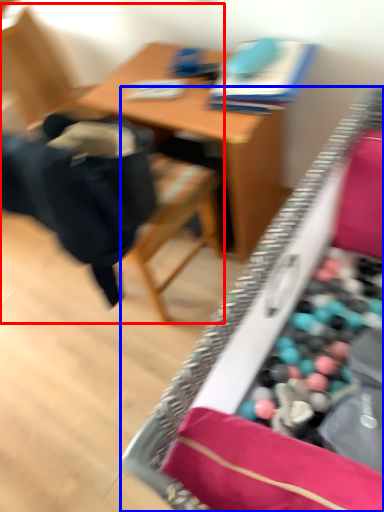
Question: Which object appears closest to the camera in this image, chair (highlighted by a red box) or desk (highlighted by a blue box)?

Choices:
 (A) chair
 (B) desk

Answer: (B)